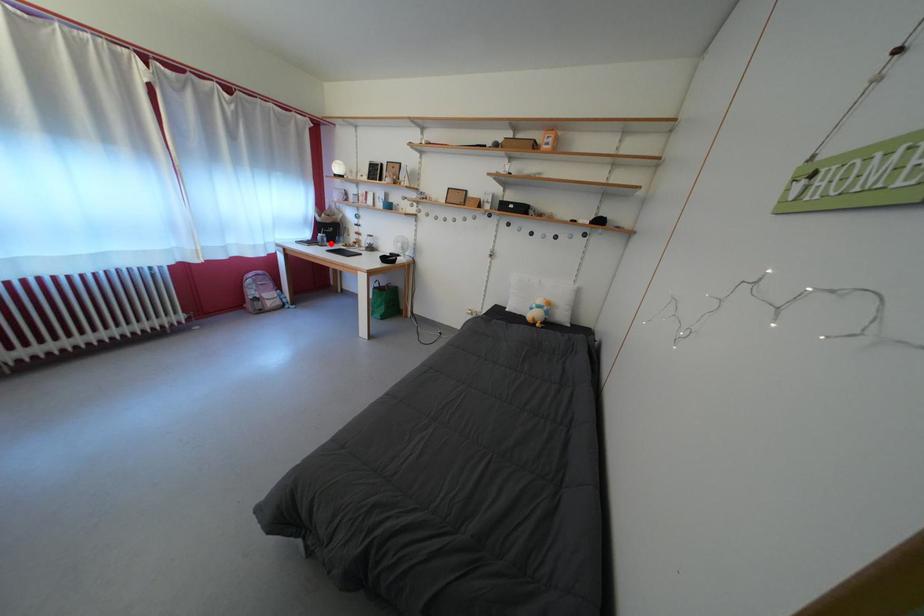
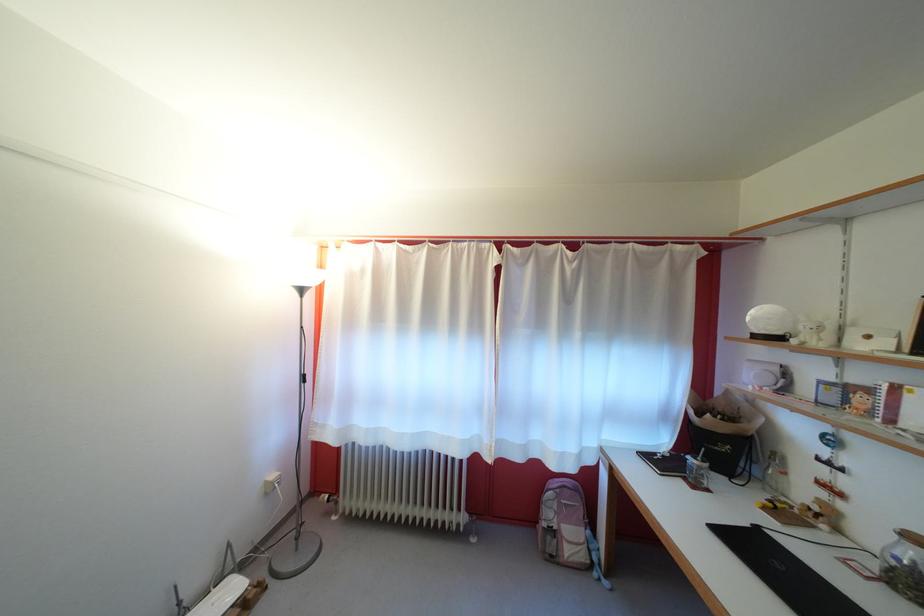
Question: I am providing you with two images of the same scene from different viewpoints. Given a red point in image1, look at the same physical point in image2. Is it:

Choices:
 (A) Closer to the viewpoint
 (B) Farther from the viewpoint

Answer: (B)